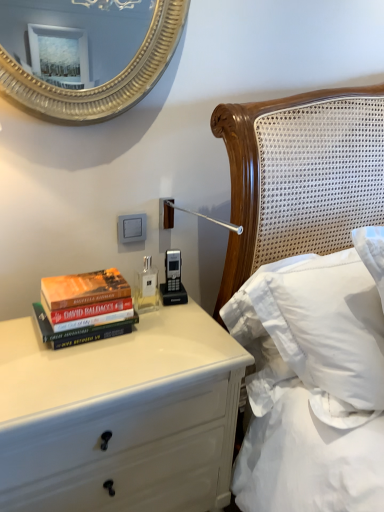
The image size is (384, 512). Find the location of `free spot to the right of clear glass bottle at center`. free spot to the right of clear glass bottle at center is located at coordinates (194, 322).